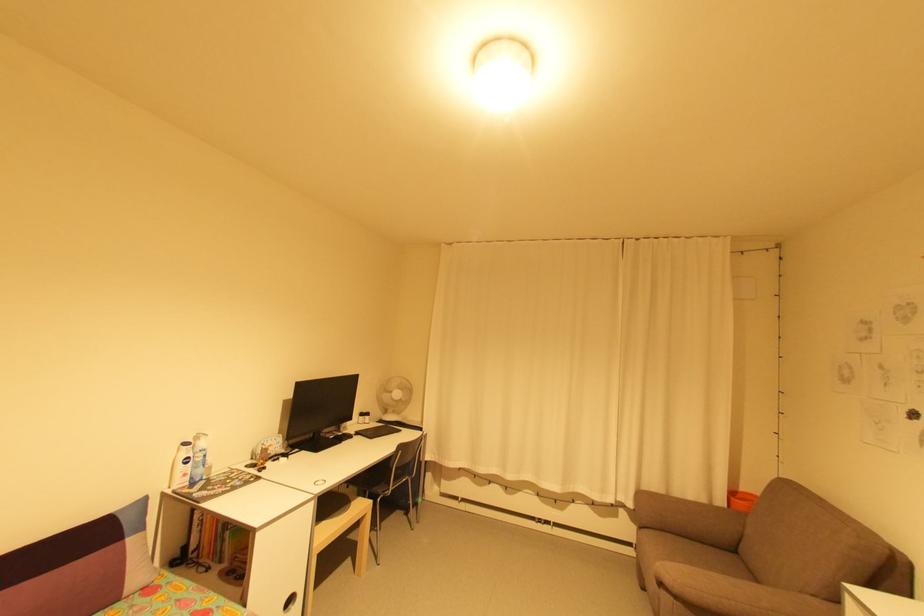
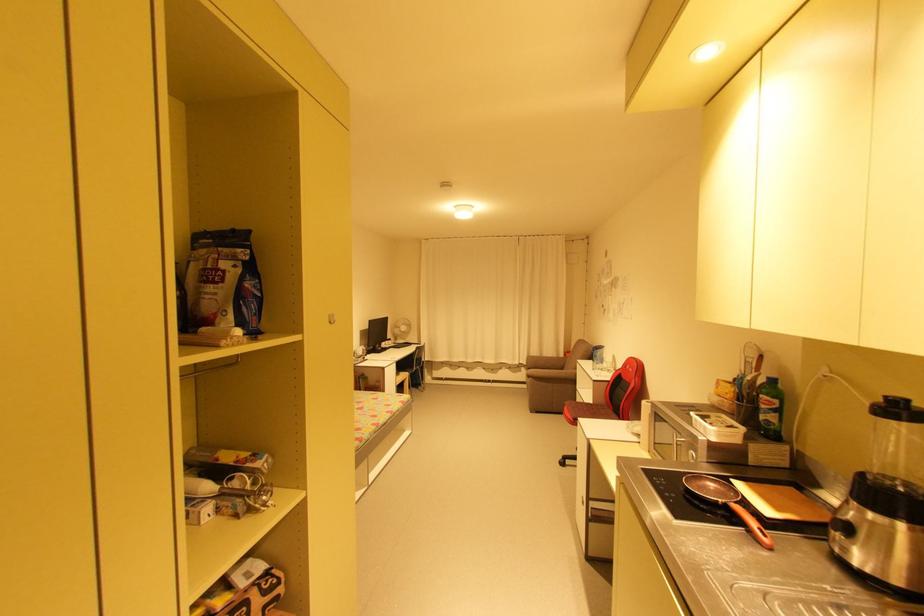
In the second image, find the point that corresponds to (621,517) in the first image.

(525, 371)